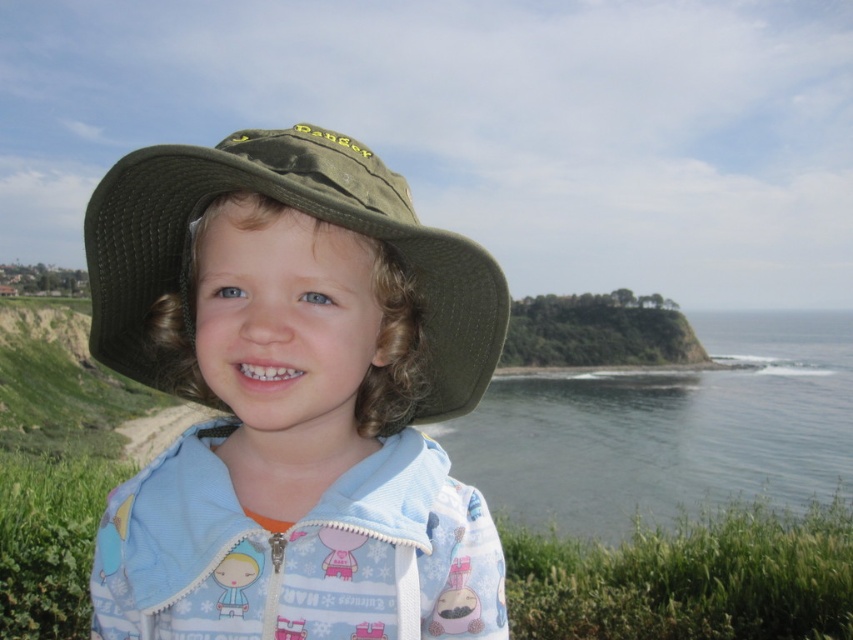
You are a photographer trying to capture a portrait of the child wearing the green fabric hat at center. The camera you are using has a minimum focusing distance of 28 inches. Can you take a clear photo of the child without moving closer?

The green fabric hat at center and camera are 30.25 inches apart. Since the minimum focusing distance is 28 inches, the photographer can take a clear photo without moving closer because the distance is within the camera range.

Based on the photo, you are a photographer trying to capture the child in the image. Since the green fabric hat at center and the clear blue water at lower right are both in the frame, which object should you focus on first to ensure the child is in focus?

The green fabric hat at center is behind the clear blue water at lower right, so you should focus on the green fabric hat at center first to ensure the child is in focus.